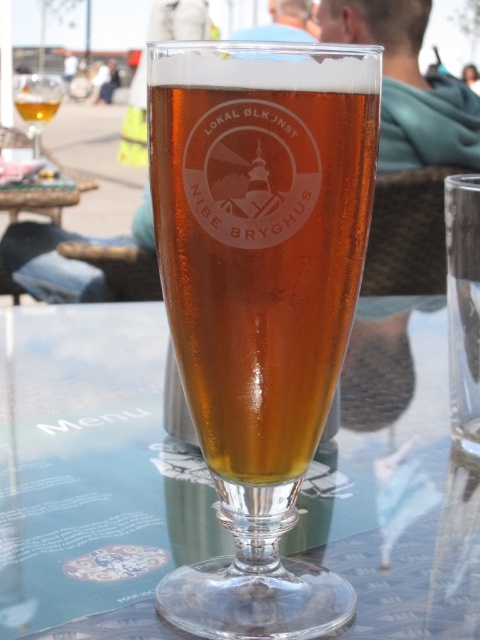
You are a bartender trying to clean the table. You see the translucent glass beer glass at center and the amber glass beer at center. Which object should you move first to avoid spilling the beer?

You should move the translucent glass beer glass at center first because it is in front of the amber glass beer at center, so moving it first would prevent spilling the amber glass beer at center.

You are standing at the edge of the table in the image and want to place a small coaster between the two points marked as point (179, 60) and point (189, 467). Which point should the coaster be placed closer to in order to be between them?

The coaster should be placed closer to point (179, 60) because it is in front of point (189, 467) from your perspective.

You are a photographer trying to capture the perfect shot of the glass of beer. The point of focus is at point (233, 452). If the camera is set to focus at 6 inches, will the point be in focus?

The distance of point (233, 452) from the camera is 6.30 inches, which is slightly beyond the 6 inches focus setting. Therefore, the point may not be in focus.